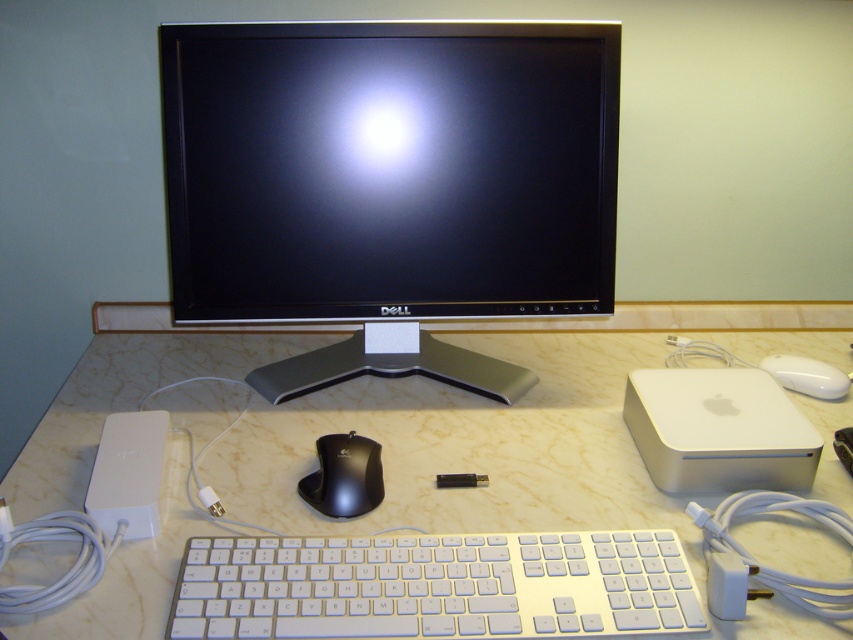
Is satin black monitor at center below white marble computer desk at center?

Actually, satin black monitor at center is above white marble computer desk at center.

Based on the photo, which is above, satin black monitor at center or white marble computer desk at center?

Positioned higher is satin black monitor at center.

Between point (445, 26) and point (190, 513), which one is positioned behind?

Positioned behind is point (445, 26).

Find the location of a particular element. satin black monitor at center is located at coordinates (389, 168).

Who is more forward, (529, 164) or (300, 593)?

Point (300, 593) is in front.

Is point (477, 60) closer to viewer compared to point (503, 602)?

No.

At what (x,y) coordinates should I click in order to perform the action: click on satin black monitor at center. Please return your answer as a coordinate pair (x, y). Looking at the image, I should click on (x=389, y=168).

Can you confirm if white marble computer desk at center is thinner than black glossy mouse at center?

Incorrect, white marble computer desk at center's width is not less than black glossy mouse at center's.

Does white marble computer desk at center have a smaller size compared to black glossy mouse at center?

No.

Does point (622, 428) come behind point (335, 438)?

Yes, point (622, 428) is farther from viewer.

At what (x,y) coordinates should I click in order to perform the action: click on white marble computer desk at center. Please return your answer as a coordinate pair (x, y). Looking at the image, I should click on [x=468, y=448].